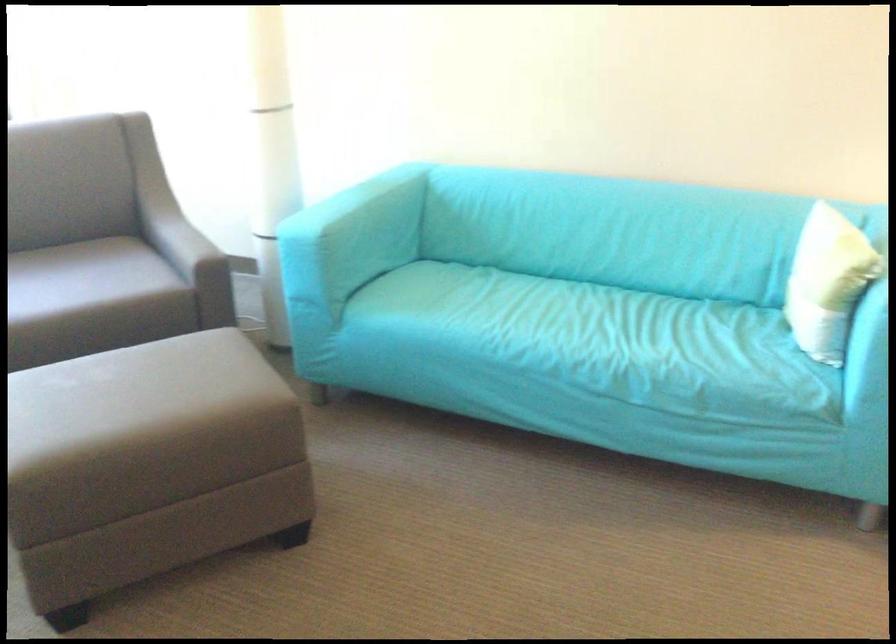
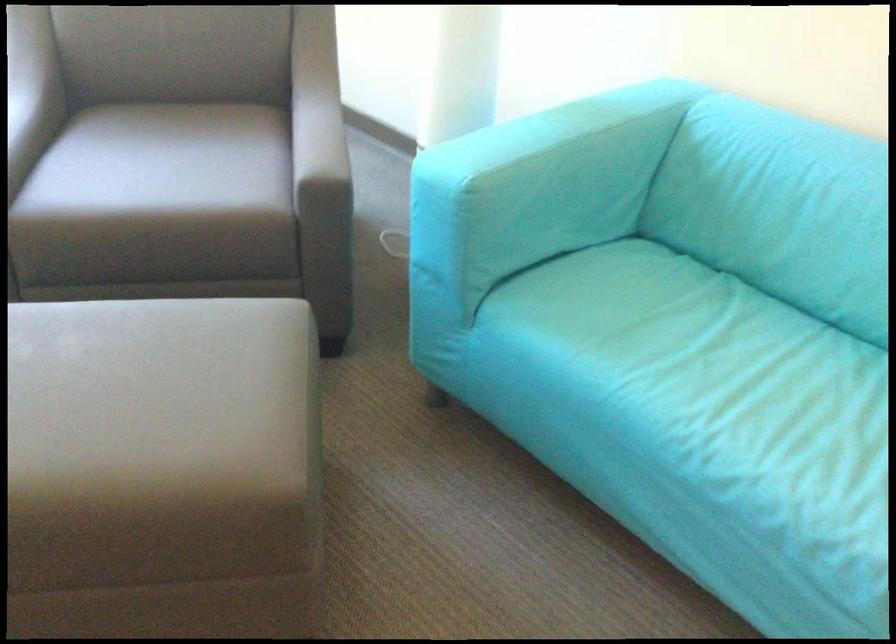
Locate, in the second image, the point that corresponds to [476,297] in the first image.

(699, 353)